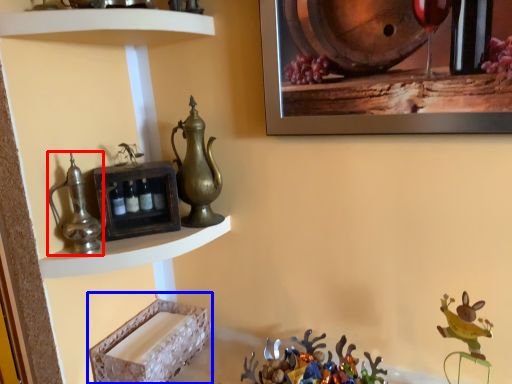
Question: Which of the following is the closest to the observer, jug (highlighted by a red box) or shelf (highlighted by a blue box)?

Choices:
 (A) jug
 (B) shelf

Answer: (A)